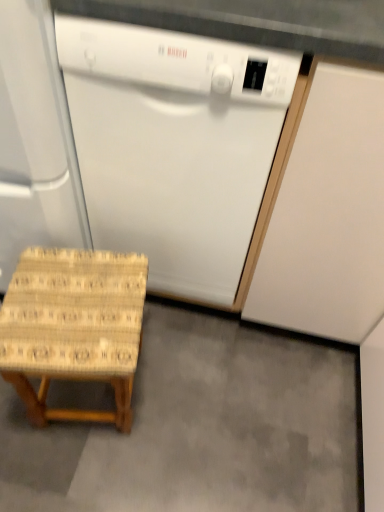
In order to click on vacant space underneath woven wood stool at lower left (from a real-world perspective) in this screenshot , I will do `click(93, 401)`.